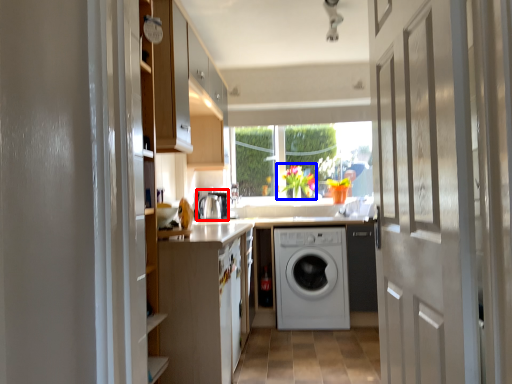
Question: Which object is closer to the camera taking this photo, appliance (highlighted by a red box) or floral arrangement (highlighted by a blue box)?

Choices:
 (A) appliance
 (B) floral arrangement

Answer: (A)